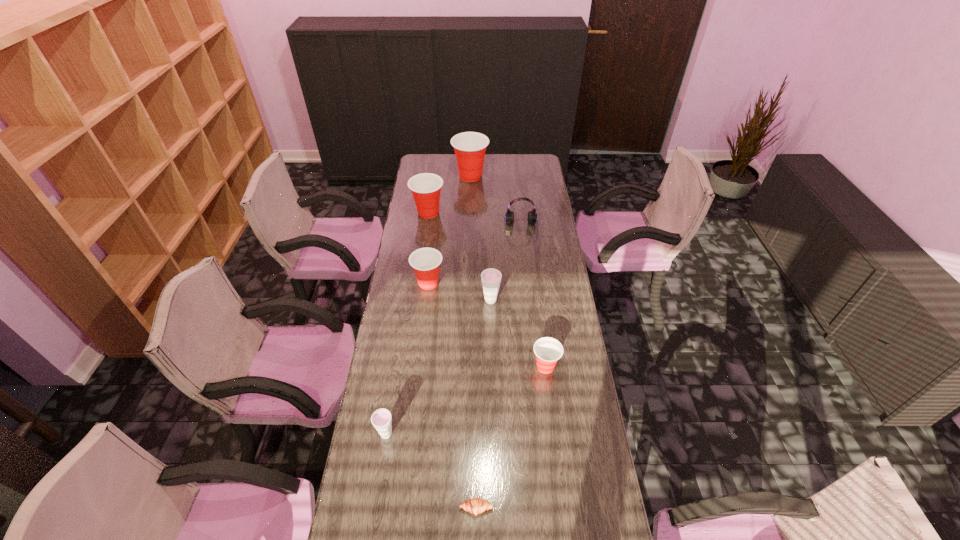
Where is `vacant region located 0.310m on the right of the smaller purple cup`? This screenshot has height=540, width=960. vacant region located 0.310m on the right of the smaller purple cup is located at coordinates (492, 434).

Identify the location of free spot located on the front-facing side of the shortest object. The height and width of the screenshot is (540, 960). (476, 537).

Where is `object that is at the far edge`? This screenshot has height=540, width=960. object that is at the far edge is located at coordinates (469, 147).

What are the coordinates of `headset present at the right edge` in the screenshot? It's located at (532, 216).

Locate an element on the screen. cup that is at the right edge is located at coordinates (548, 350).

What are the coordinates of `vacant point at the far edge` in the screenshot? It's located at (507, 156).

In the image, there is a desktop. Where is `vacant region at the left edge`? The image size is (960, 540). vacant region at the left edge is located at coordinates (400, 251).

In the image, there is a desktop. Identify the location of free region at the right edge. (536, 225).

This screenshot has height=540, width=960. In order to click on vacant area that lies between the right purple cup and the second nearest object in this screenshot , I will do `click(439, 367)`.

Find the location of a particular element. free space between the tallest object and the headset is located at coordinates (496, 202).